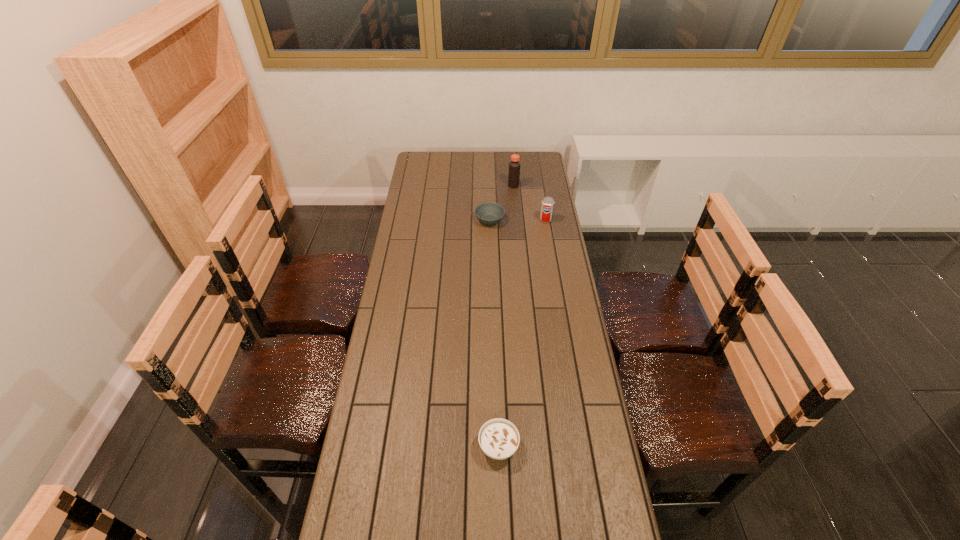
This screenshot has height=540, width=960. I want to click on free space that satisfies the following two spatial constraints: 1. on the back side of the nearer soup bowl; 2. on the right side of the soda, so click(x=492, y=220).